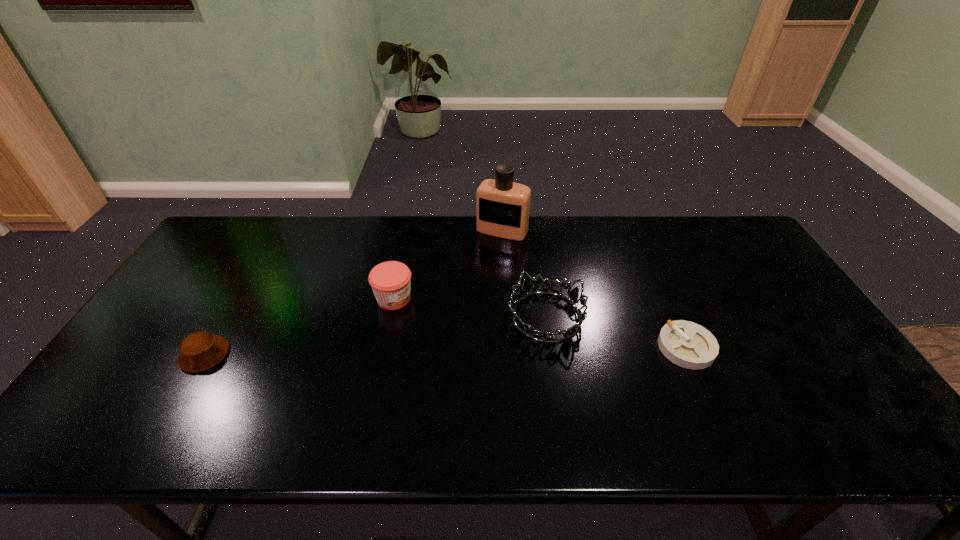
This screenshot has width=960, height=540. I want to click on vacant area that satisfies the following two spatial constraints: 1. on the front side of the shortest object; 2. on the right side of the tallest object, so click(510, 347).